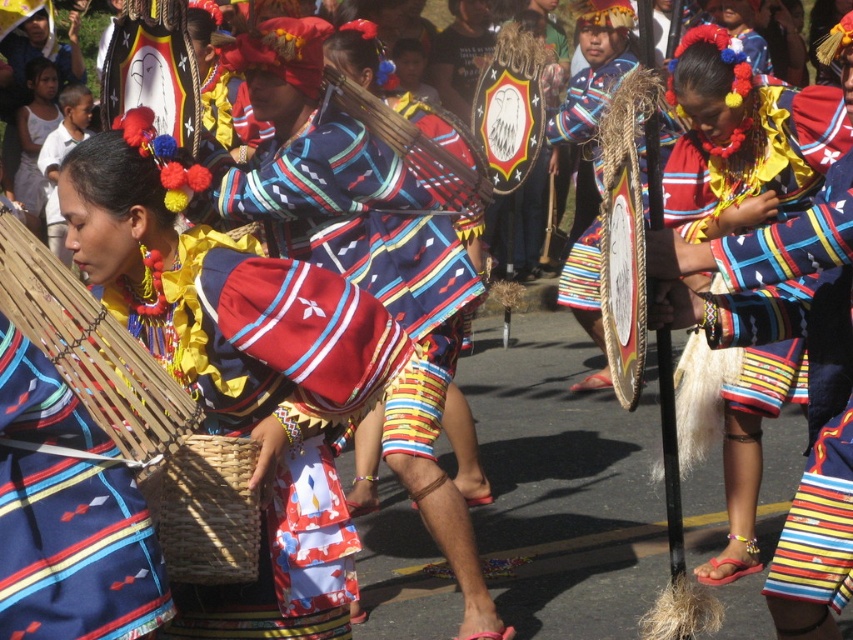
Question: Is matte multicolored skirt at center bigger than woven brown basket at lower center?

Choices:
 (A) no
 (B) yes

Answer: (B)

Question: Estimate the real-world distances between objects in this image. Which object is farther from the matte woven basket at center?

Choices:
 (A) matte multicolored skirt at center
 (B) woven brown basket at lower center
 (C) matte fabric skirt at center

Answer: (A)

Question: Which is nearer to the woven brown basket at lower center?

Choices:
 (A) matte fabric skirt at center
 (B) matte woven basket at center

Answer: (B)

Question: Which object appears farthest from the camera in this image?

Choices:
 (A) matte woven basket at center
 (B) matte fabric skirt at center

Answer: (B)

Question: Does matte woven basket at center appear under matte multicolored skirt at center?

Choices:
 (A) yes
 (B) no

Answer: (A)

Question: Can you confirm if matte multicolored skirt at center is smaller than woven brown basket at lower center?

Choices:
 (A) no
 (B) yes

Answer: (A)